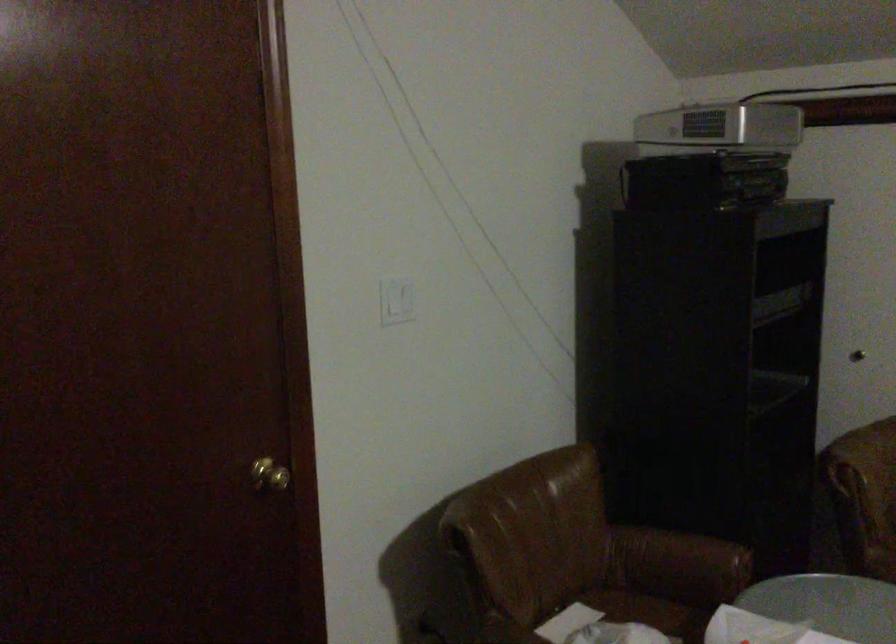
Describe the element at coordinates (679, 559) in the screenshot. I see `a chair armrest` at that location.